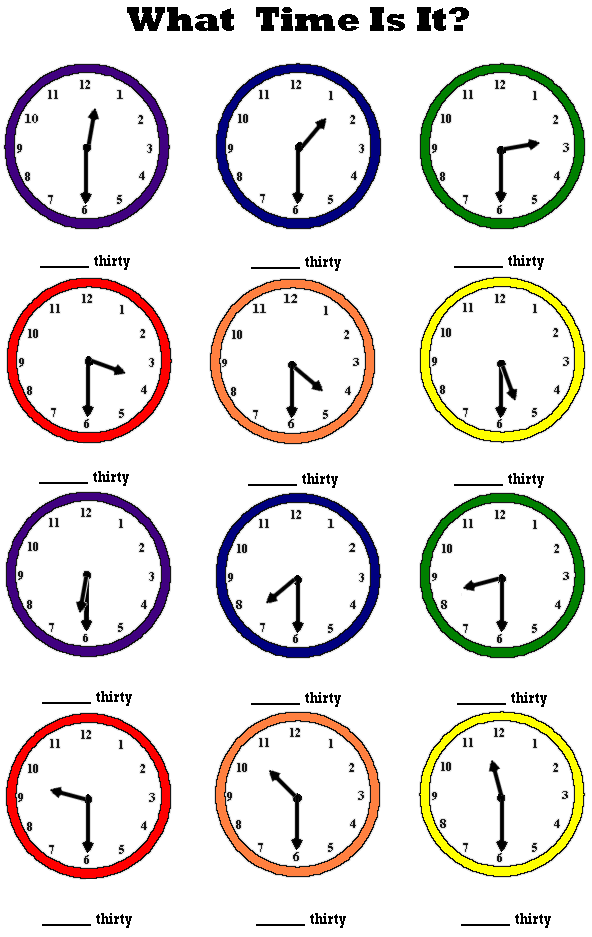
This screenshot has width=592, height=937. Find the location of `yellow clock`. yellow clock is located at coordinates (522, 545), (535, 765), (514, 345).